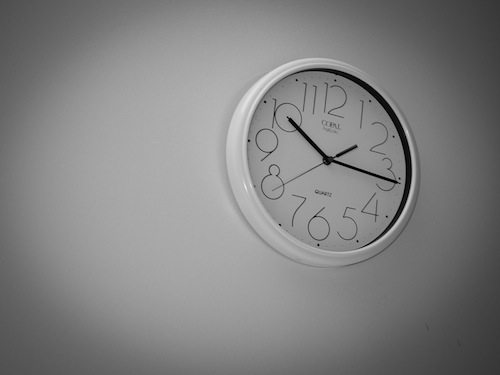
This screenshot has width=500, height=375. I want to click on clock, so click(354, 193).